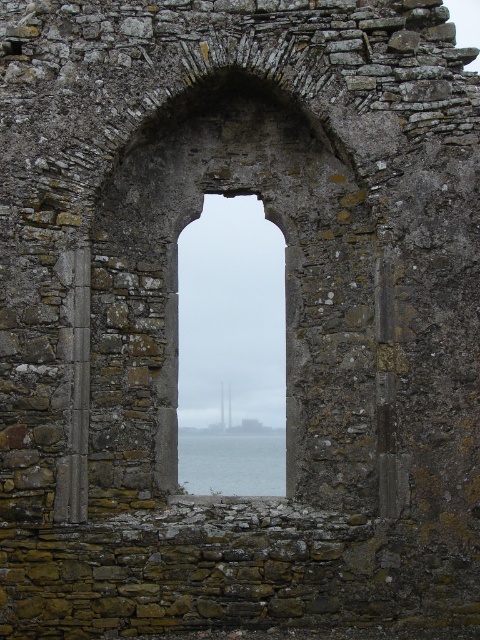
Between transparent glass window at center and transparent glass water at center, which one has more height?

With more height is transparent glass window at center.

Is point (201, 332) in front of point (262, 440)?

Yes, point (201, 332) is in front of point (262, 440).

The height and width of the screenshot is (640, 480). I want to click on transparent glass window at center, so click(231, 320).